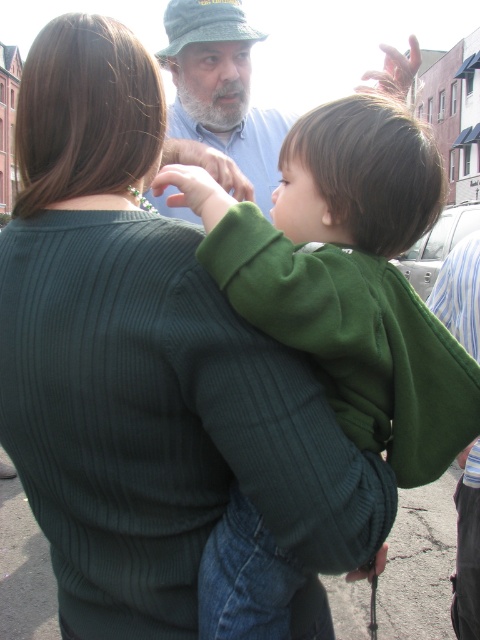
Question: Does green corduroy sweater at center appear on the left side of light blue shirt at upper center?

Choices:
 (A) no
 (B) yes

Answer: (A)

Question: Which point appears farthest from the camera in this image?

Choices:
 (A) pos(272,257)
 (B) pos(242,173)

Answer: (B)

Question: Is green corduroy sweater at center thinner than light blue shirt at upper center?

Choices:
 (A) yes
 (B) no

Answer: (B)

Question: Among these objects, which one is farthest from the camera?

Choices:
 (A) green corduroy sweater at center
 (B) light blue shirt at upper center

Answer: (B)

Question: Which of the following is the farthest from the observer?

Choices:
 (A) (171, 76)
 (B) (375, 378)

Answer: (A)

Question: Does green corduroy sweater at center appear under light blue shirt at upper center?

Choices:
 (A) yes
 (B) no

Answer: (A)